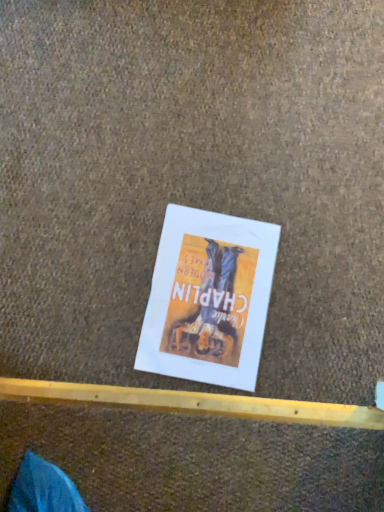
The width and height of the screenshot is (384, 512). Describe the element at coordinates (209, 298) in the screenshot. I see `white paper poster at center` at that location.

Find the location of a particular element. The width and height of the screenshot is (384, 512). white paper poster at center is located at coordinates (209, 298).

Identify the location of white paper poster at center. The image size is (384, 512). coord(209,298).